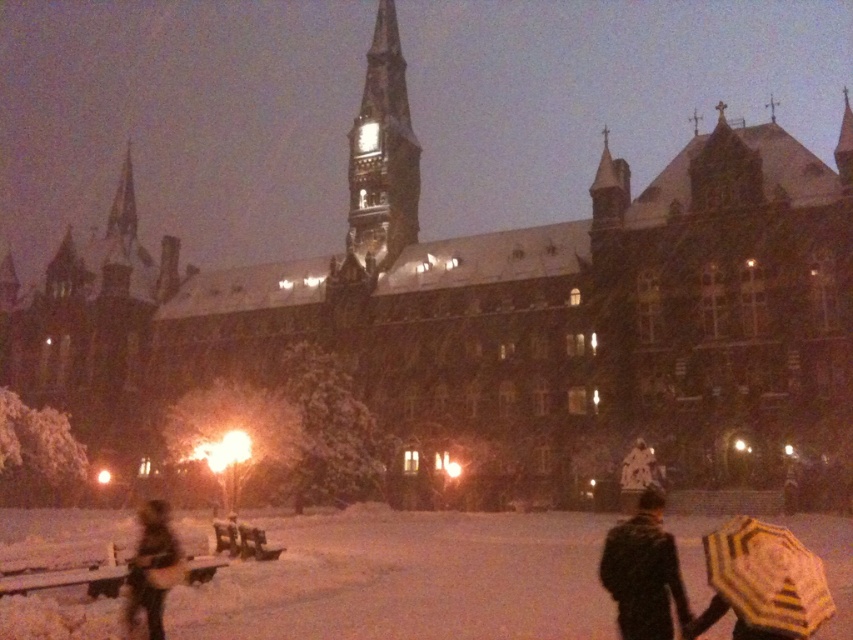
Question: Is dark gray stone clock tower at center smaller than dark textured coat at lower right?

Choices:
 (A) no
 (B) yes

Answer: (A)

Question: Does yellow striped fabric umbrella at lower right have a smaller size compared to dark brown leather jacket at lower left?

Choices:
 (A) yes
 (B) no

Answer: (A)

Question: Based on their relative distances, which object is farther from the dark brown leather jacket at lower left?

Choices:
 (A) yellow striped fabric umbrella at lower right
 (B) dark gray stone clock tower at center
 (C) dark textured coat at lower right

Answer: (B)

Question: Estimate the real-world distances between objects in this image. Which object is farther from the dark brown leather jacket at lower left?

Choices:
 (A) yellow striped fabric umbrella at lower right
 (B) dark gray stone clock tower at center
 (C) dark textured coat at lower right

Answer: (B)

Question: Can you confirm if dark textured coat at lower right is wider than dark brown leather jacket at lower left?

Choices:
 (A) no
 (B) yes

Answer: (A)

Question: Which point appears closest to the camera in this image?

Choices:
 (A) (412, 173)
 (B) (815, 554)

Answer: (B)